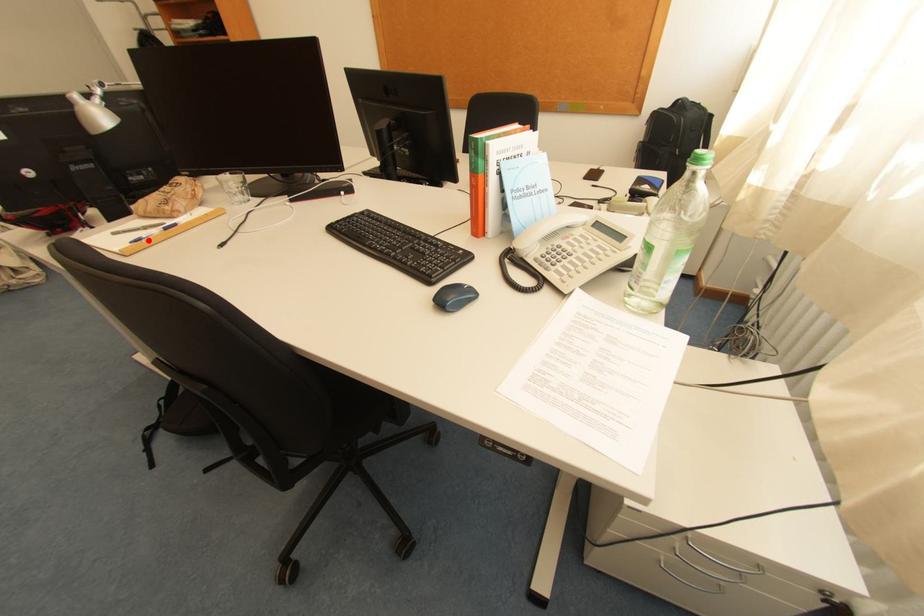
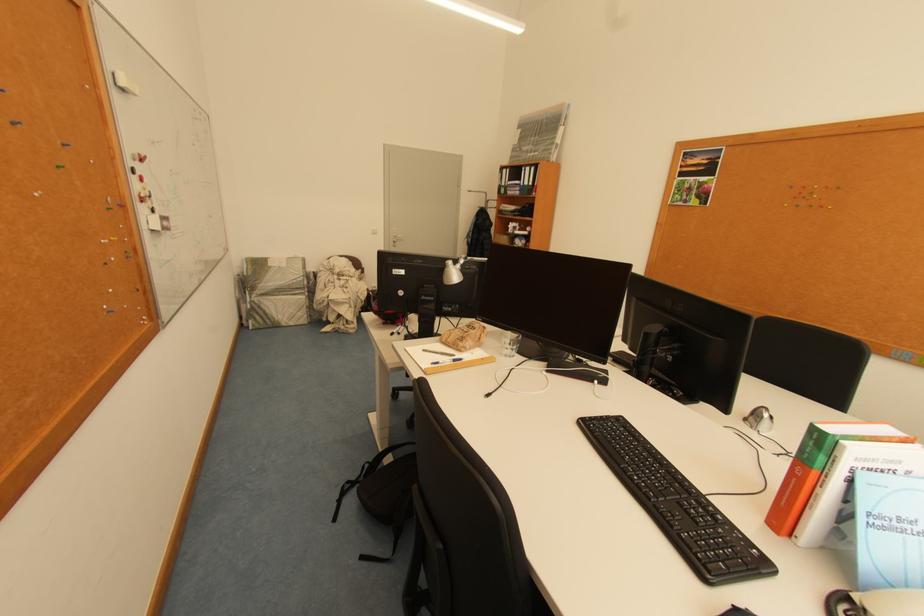
Where in the second image is the point corresponding to the highlighted location from the first image?

(445, 363)